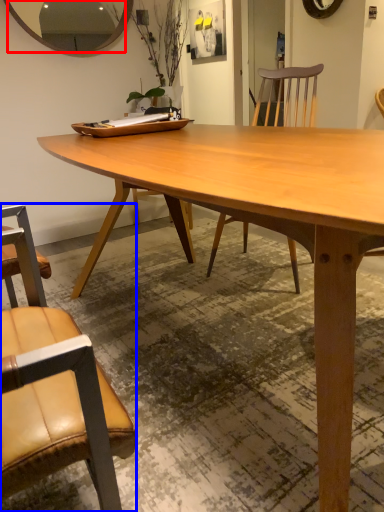
Question: Which object appears closest to the camera in this image, mirror (highlighted by a red box) or chair (highlighted by a blue box)?

Choices:
 (A) mirror
 (B) chair

Answer: (B)